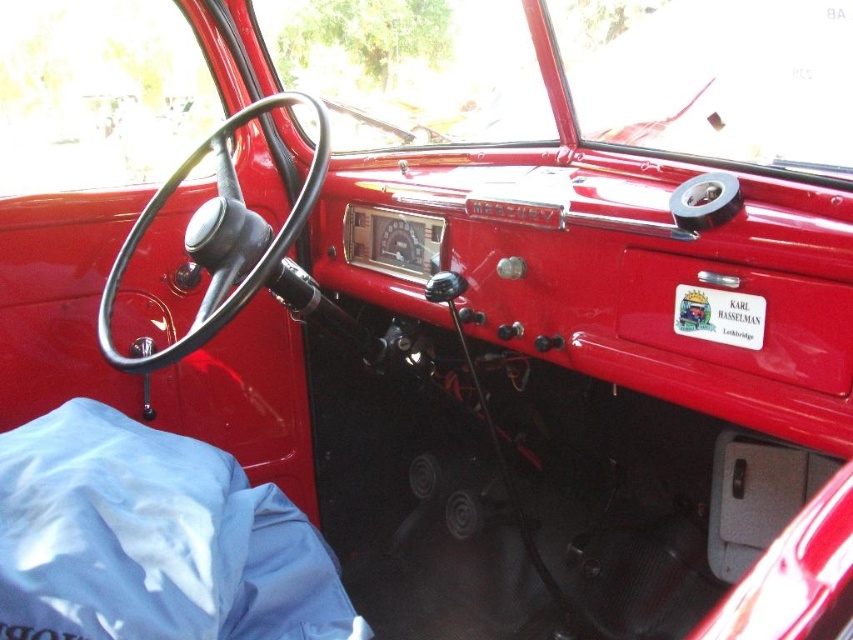
Question: Can you confirm if black leather steering wheel at center is wider than white sticker at center?

Choices:
 (A) yes
 (B) no

Answer: (A)

Question: Does black leather steering wheel at center have a lesser width compared to white sticker at center?

Choices:
 (A) yes
 (B) no

Answer: (B)

Question: Does black leather steering wheel at center appear on the right side of white sticker at center?

Choices:
 (A) yes
 (B) no

Answer: (B)

Question: Which point is closer to the camera taking this photo?

Choices:
 (A) [746, 323]
 (B) [160, 193]

Answer: (A)

Question: Which object appears closest to the camera in this image?

Choices:
 (A) white sticker at center
 (B) black leather steering wheel at center

Answer: (A)